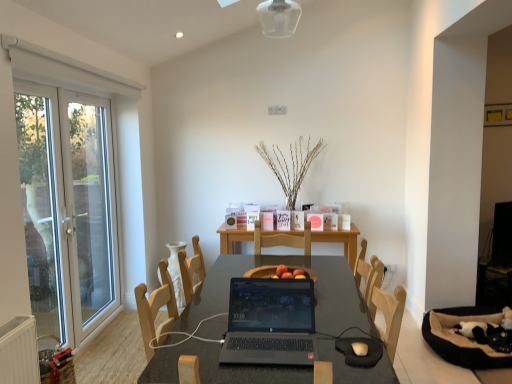
Question: In the image, is matte white mouse at center positioned in front of or behind black glossy table at center?

Choices:
 (A) behind
 (B) front

Answer: (A)

Question: Is point (366, 354) positioned closer to the camera than point (170, 372)?

Choices:
 (A) closer
 (B) farther

Answer: (B)

Question: Estimate the real-world distances between objects in this image. Which object is farther from the black glossy table at center?

Choices:
 (A) white glass screen door at left, positioned as the 1th screen door in back-to-front order
 (B) matte white mouse at center
 (C) white glass screen door at left, the first screen door positioned from the front
 (D) black matte laptop at center
 (E) white glass door at left

Answer: (C)

Question: Estimate the real-world distances between objects in this image. Which object is farther from the matte white mouse at center?

Choices:
 (A) white glass screen door at left, which is the second screen door in back-to-front order
 (B) white glass door at left
 (C) black matte laptop at center
 (D) black glossy table at center
 (E) white glass screen door at left, the second screen door from the front

Answer: (E)